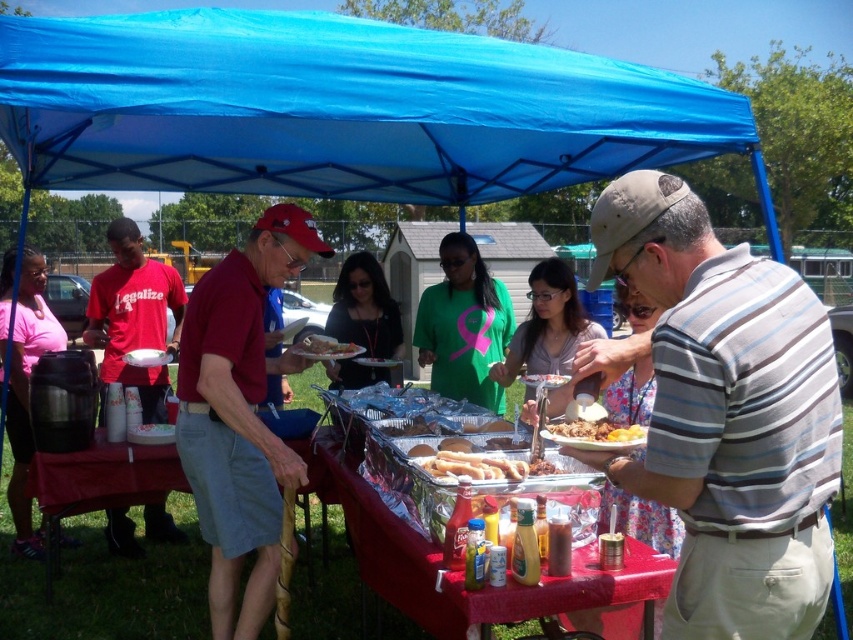
Between metallic silver tray at center and matte red t-shirt at left, which one appears on the right side from the viewer's perspective?

From the viewer's perspective, metallic silver tray at center appears more on the right side.

Does metallic silver tray at center have a lesser width compared to matte red t-shirt at left?

Incorrect, metallic silver tray at center's width is not less than matte red t-shirt at left's.

Between point (354, 480) and point (144, 275), which one is positioned in front?

Point (354, 480) is more forward.

Identify the location of metallic silver tray at center. (461, 572).

Can you confirm if metallic silver tray at center is bigger than golden brown hot dog bun at center?

Indeed, metallic silver tray at center has a larger size compared to golden brown hot dog bun at center.

The height and width of the screenshot is (640, 853). I want to click on metallic silver tray at center, so click(x=461, y=572).

This screenshot has height=640, width=853. Describe the element at coordinates (326, 348) in the screenshot. I see `slightly toasted bread at center` at that location.

Which is behind, point (302, 346) or point (444, 442)?

The point (302, 346) is more distant.

Where is `slightly toasted bread at center`? slightly toasted bread at center is located at coordinates (326, 348).